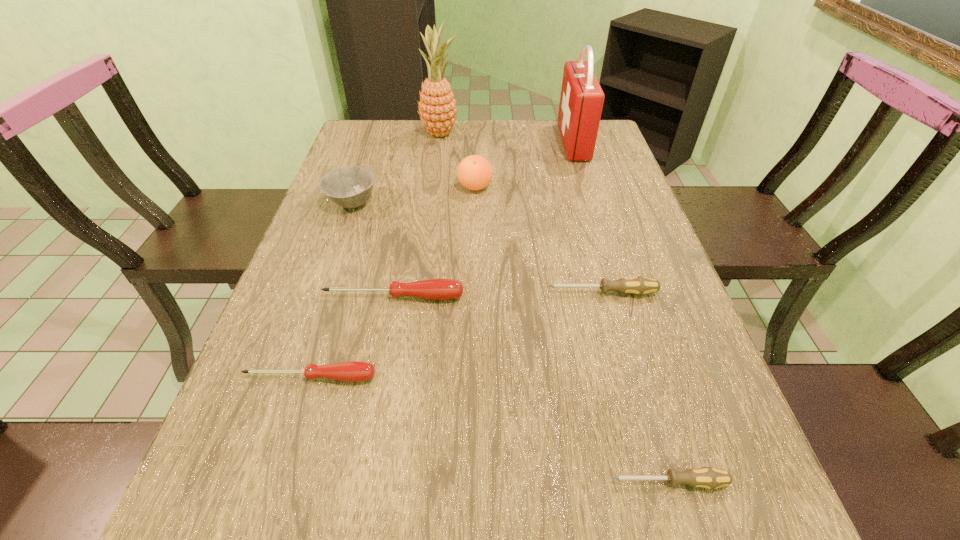
Locate an element on the screen. free spot between the nearer gray screwdriver and the second nearest screwdriver is located at coordinates (490, 430).

This screenshot has height=540, width=960. In order to click on vacant area between the orange orange and the red first-aid kit in this screenshot , I will do `click(524, 165)`.

Locate which object ranks third in proximity to the fifth shortest object. Please provide its 2D coordinates. Your answer should be formatted as a tuple, i.e. [(x, y)], where the tuple contains the x and y coordinates of a point satisfying the conditions above.

[(437, 107)]

The height and width of the screenshot is (540, 960). I want to click on the third closest object to the fifth shortest object, so click(x=437, y=107).

Identify which screwdriver is the fourth nearest to the red first-aid kit. Please provide its 2D coordinates. Your answer should be formatted as a tuple, i.e. [(x, y)], where the tuple contains the x and y coordinates of a point satisfying the conditions above.

[(710, 478)]

Identify the location of screwdriver identified as the second closest to the orange. The height and width of the screenshot is (540, 960). (638, 285).

I want to click on free space in the image that satisfies the following two spatial constraints: 1. on the front side of the seventh farthest object; 2. on the left side of the fifth shortest object, so click(x=293, y=377).

Locate an element on the screen. The width and height of the screenshot is (960, 540). vacant space that satisfies the following two spatial constraints: 1. on the back side of the nearer red screwdriver; 2. on the right side of the farther red screwdriver is located at coordinates (336, 297).